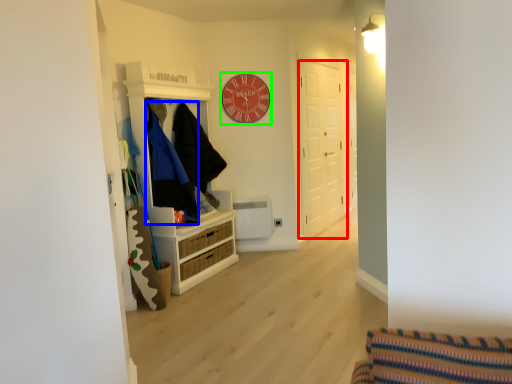
Question: Considering the real-world distances, which object is farthest from door (highlighted by a red box)? clothing (highlighted by a blue box) or clock (highlighted by a green box)?

Choices:
 (A) clothing
 (B) clock

Answer: (A)